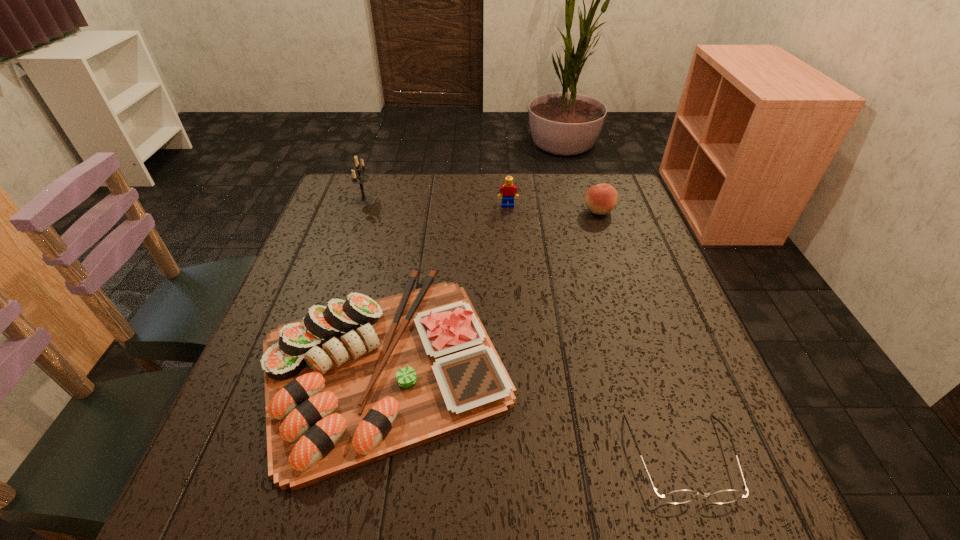
Locate an element on the screen. The width and height of the screenshot is (960, 540). vacant region that satisfies the following two spatial constraints: 1. on the front-facing side of the peach; 2. on the left side of the second tallest object is located at coordinates (508, 211).

The height and width of the screenshot is (540, 960). In order to click on free location that satisfies the following two spatial constraints: 1. on the front-facing side of the fourth shortest object; 2. on the left side of the peach in this screenshot , I will do `click(508, 211)`.